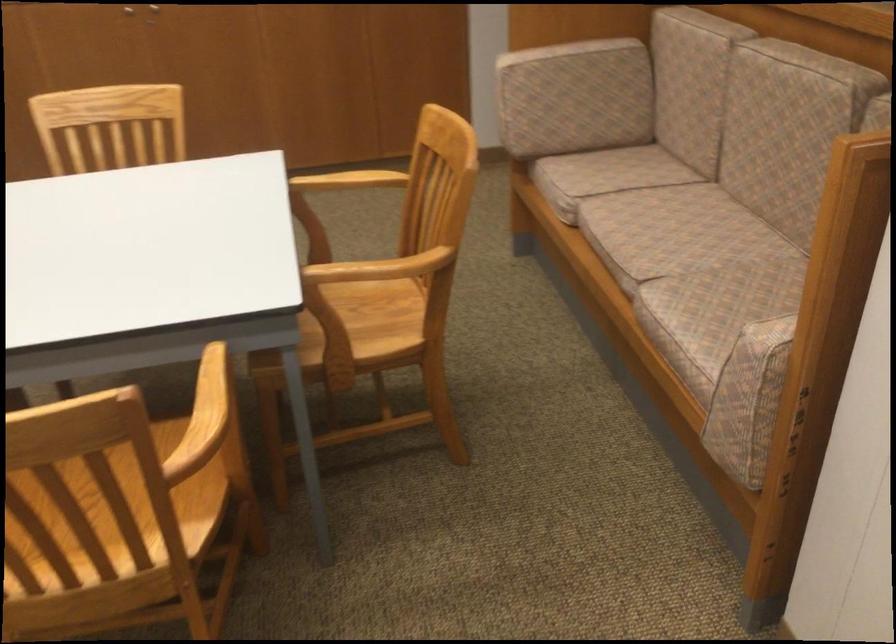
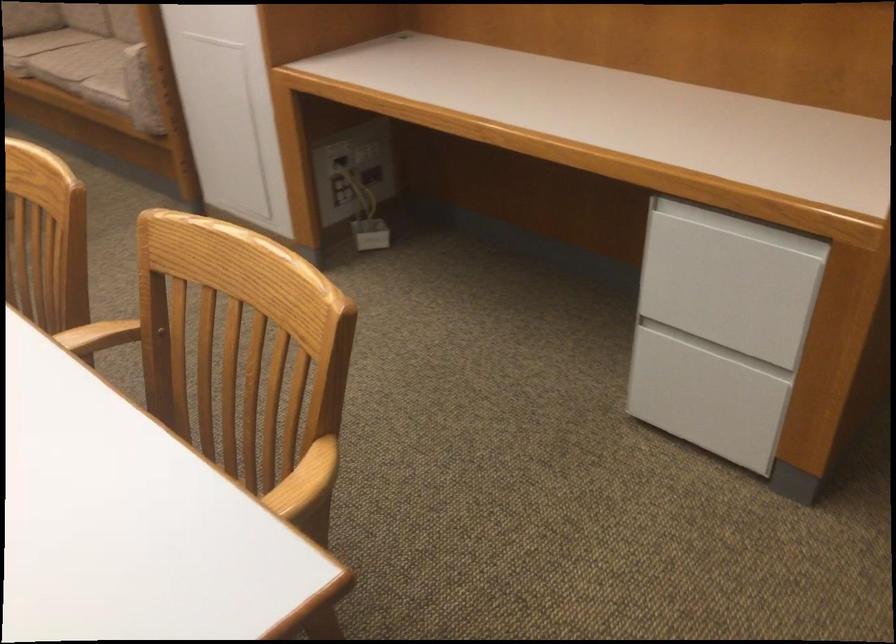
Locate, in the second image, the point that corresponds to point (631, 234) in the first image.

(76, 61)